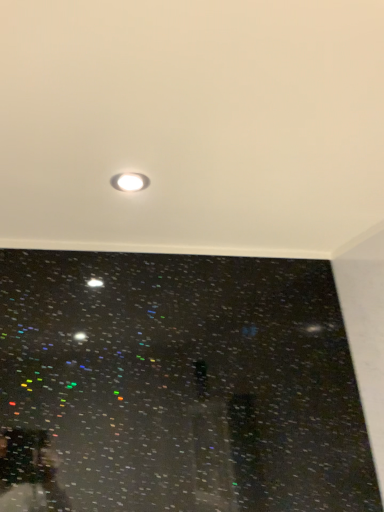
What is the approximate height of matte white ceiling at center?

matte white ceiling at center is 8.11 centimeters tall.

In order to face matte white ceiling at center, should I rotate leftwards or rightwards?

Rotate right and turn 4.518 degrees.

What do you see at coordinates (192, 126) in the screenshot? I see `matte white ceiling at center` at bounding box center [192, 126].

Locate an element on the screen. This screenshot has width=384, height=512. matte white ceiling at center is located at coordinates (192, 126).

What are the coordinates of `matte white ceiling at center` in the screenshot? It's located at (192, 126).